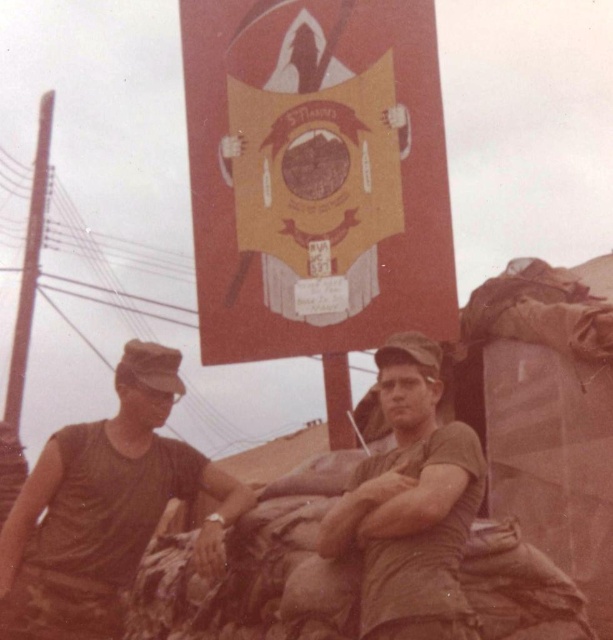
Based on the photo, you are a drone operator controlling a drone that can only detect objects within 50 meters. You observe the scene described and see the camouflage fabric uniform at left. Can your drone detect it?

The camouflage fabric uniform at left is 53.41 meters away from the camera, which is beyond the drone operator drone detection range of 50 meters. Therefore, the drone cannot detect the camouflage fabric uniform at left.

You are a tailor who needs to compare the width of the uniforms to ensure proper alterations. Which uniform has a greater width between the camouflage fabric uniform at left and the matte green uniform at center?

The camouflage fabric uniform at left has a greater width than the matte green uniform at center as stated in the description.

You are a photographer trying to capture both the camouflage fabric uniform at left and the matte green uniform at center in a single frame. Based on their positions, which uniform will appear higher in the photo?

The matte green uniform at center appears higher in the photo because the camouflage fabric uniform at left is located below it.